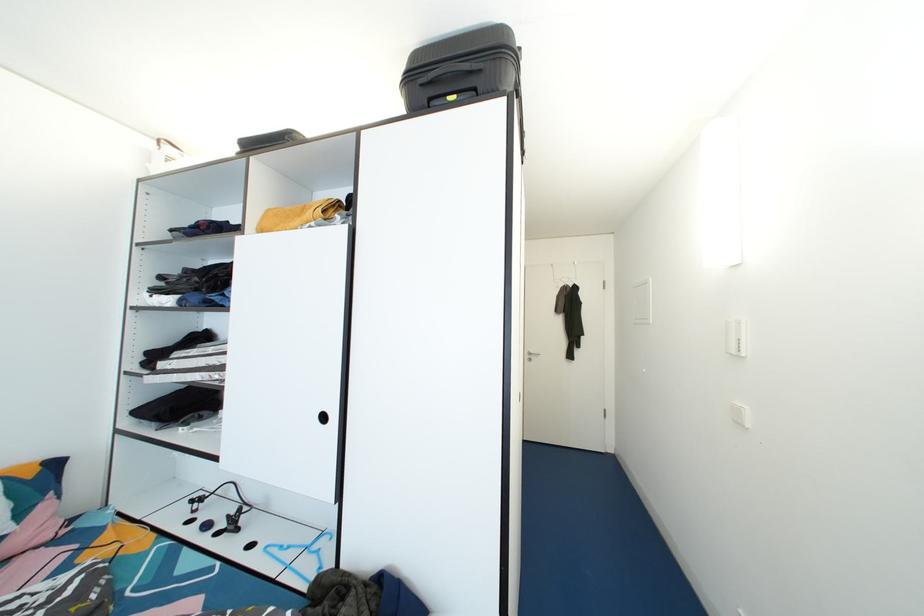
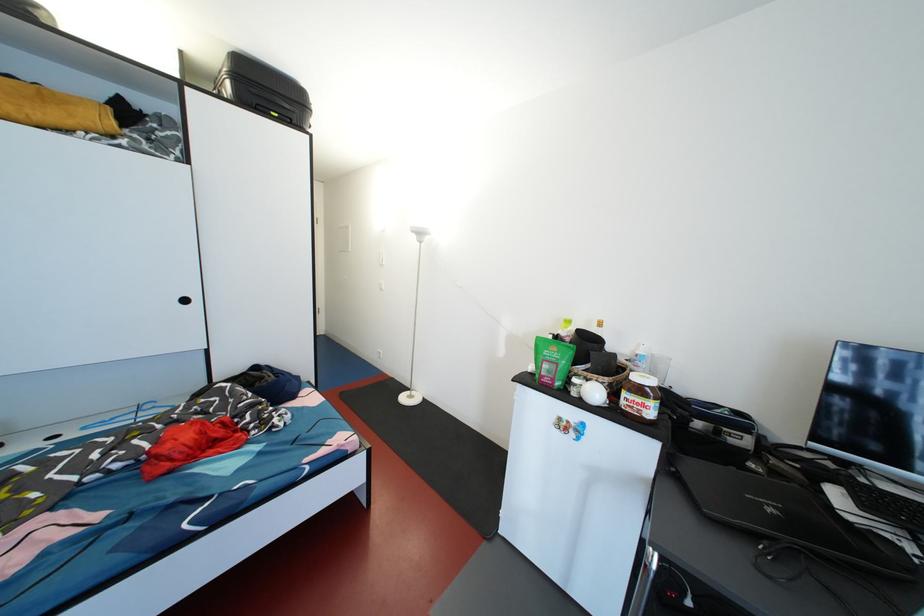
Locate, in the second image, the point that corresponds to (x=460, y=102) in the first image.

(283, 120)